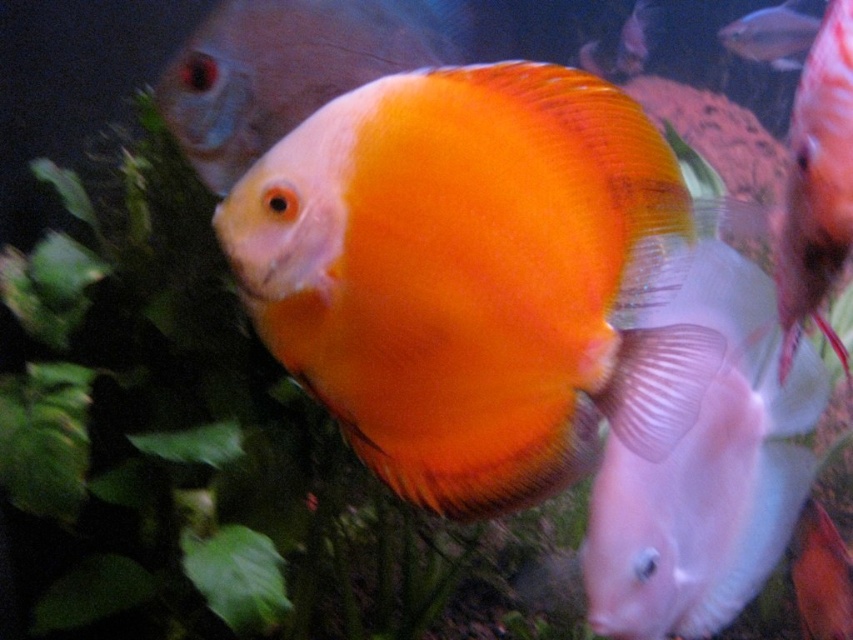
You are an underwater photographer aiming to capture a clear shot of the orange matte discus at center and the matte white fish at lower right. Which fish should you focus on to ensure the other appears blurred in the background?

The orange matte discus at center is in front of the matte white fish at lower right. If you focus on the orange matte discus at center, the matte white fish at lower right will appear blurred in the background.

You are an aquarium maintenance worker. You need to determine which fish is larger between the orange matte discus at center and the translucent glass fish at upper right. Based on the scene, which one is bigger?

The translucent glass fish at upper right is larger than the orange matte discus at center according to the description.